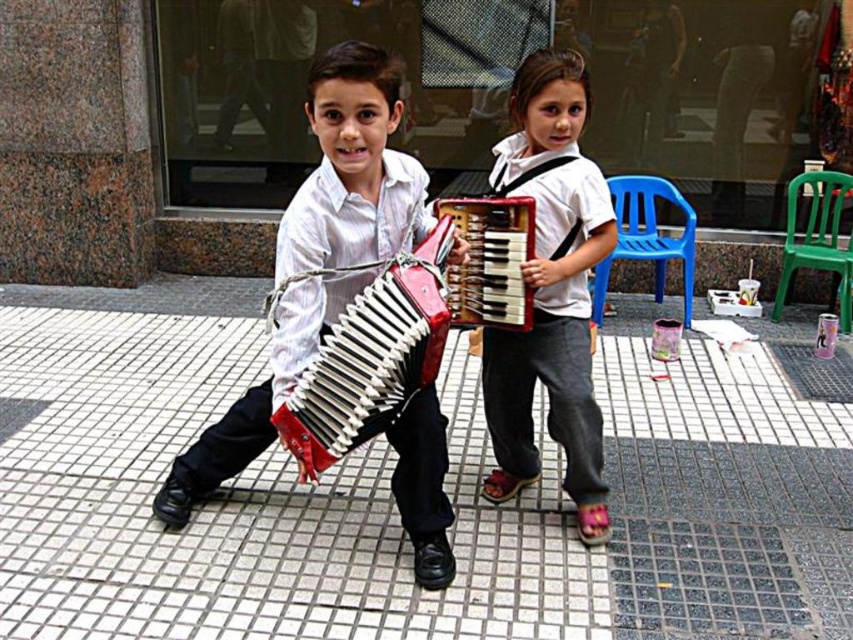
Question: Estimate the real-world distances between objects in this image. Which object is closer to the white tile pavement at center?

Choices:
 (A) matte red accordion at center
 (B) white cotton shirt at center
 (C) red matte accordion at center
 (D) matte black accordion at center

Answer: (B)

Question: Based on their relative distances, which object is farther from the matte red accordion at center?

Choices:
 (A) matte black accordion at center
 (B) white cotton shirt at center
 (C) white tile pavement at center
 (D) red matte accordion at center

Answer: (C)

Question: Does white tile pavement at center come in front of matte red accordion at center?

Choices:
 (A) yes
 (B) no

Answer: (B)

Question: Can you confirm if matte red accordion at center is positioned to the right of red matte accordion at center?

Choices:
 (A) yes
 (B) no

Answer: (B)

Question: Which point is farther from the camera taking this photo?

Choices:
 (A) (537, 192)
 (B) (647, 452)
 (C) (322, 388)

Answer: (B)

Question: Is matte black accordion at center above red matte accordion at center?

Choices:
 (A) no
 (B) yes

Answer: (A)